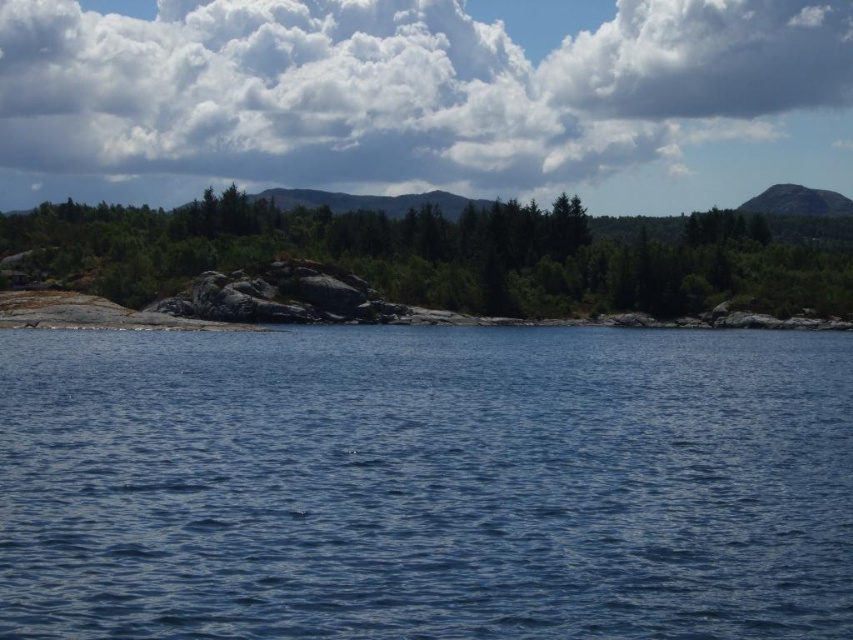
Question: Is blue liquid water at center closer to camera compared to green matte tree at center?

Choices:
 (A) yes
 (B) no

Answer: (A)

Question: Which object is positioned farthest from the gray rock mountain at upper right?

Choices:
 (A) green matte tree at center
 (B) cloudy sky at upper center
 (C) blue liquid water at center

Answer: (C)

Question: Where is cloudy sky at upper center located in relation to gray rock mountain at upper right in the image?

Choices:
 (A) above
 (B) below

Answer: (A)

Question: Which object appears farthest from the camera in this image?

Choices:
 (A) blue liquid water at center
 (B) cloudy sky at upper center
 (C) gray rock mountain at upper right

Answer: (B)

Question: Which object appears farthest from the camera in this image?

Choices:
 (A) blue liquid water at center
 (B) green matte tree at center
 (C) cloudy sky at upper center
 (D) gray rock mountain at upper right

Answer: (C)

Question: Is cloudy sky at upper center to the right of green matte tree at center from the viewer's perspective?

Choices:
 (A) yes
 (B) no

Answer: (B)